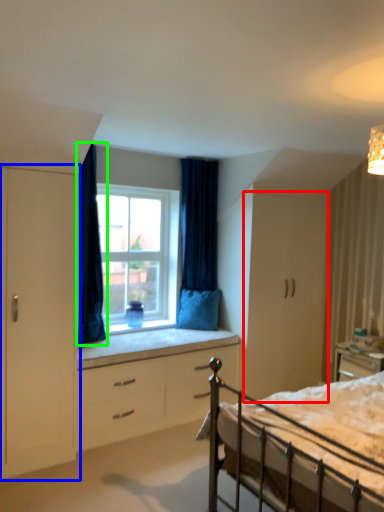
Question: Based on their relative distances, which object is farther from cabinetry (highlighted by a red box)? Choose from armoire (highlighted by a blue box) and curtain (highlighted by a green box).

Choices:
 (A) armoire
 (B) curtain

Answer: (A)